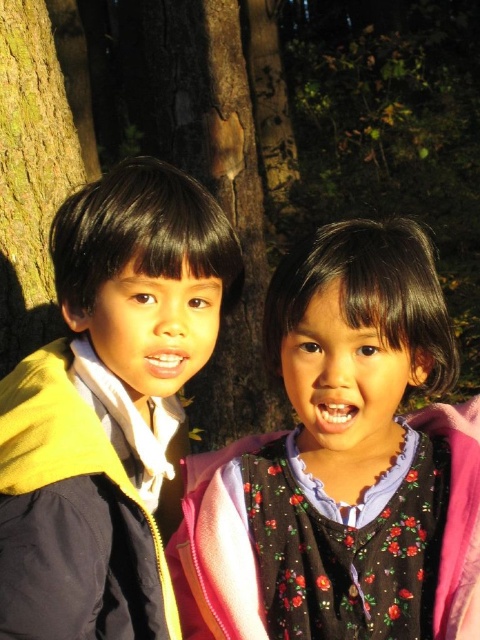
Can you confirm if floral-patterned dress at center is smaller than yellow matte jacket at left?

Yes.

Describe the element at coordinates (343, 464) in the screenshot. Image resolution: width=480 pixels, height=640 pixels. I see `floral-patterned dress at center` at that location.

This screenshot has width=480, height=640. I want to click on floral-patterned dress at center, so click(343, 464).

Does yellow matte jacket at left lie behind green rough bark at left?

No, yellow matte jacket at left is in front of green rough bark at left.

Which is in front, point (75, 205) or point (35, 275)?

Point (75, 205) is in front.

In order to click on yellow matte jacket at left in this screenshot , I will do `click(108, 404)`.

Can you confirm if floral-patterned dress at center is bigger than green rough bark at left?

Correct, floral-patterned dress at center is larger in size than green rough bark at left.

Image resolution: width=480 pixels, height=640 pixels. What do you see at coordinates (343, 464) in the screenshot?
I see `floral-patterned dress at center` at bounding box center [343, 464].

Locate an element on the screen. floral-patterned dress at center is located at coordinates (343, 464).